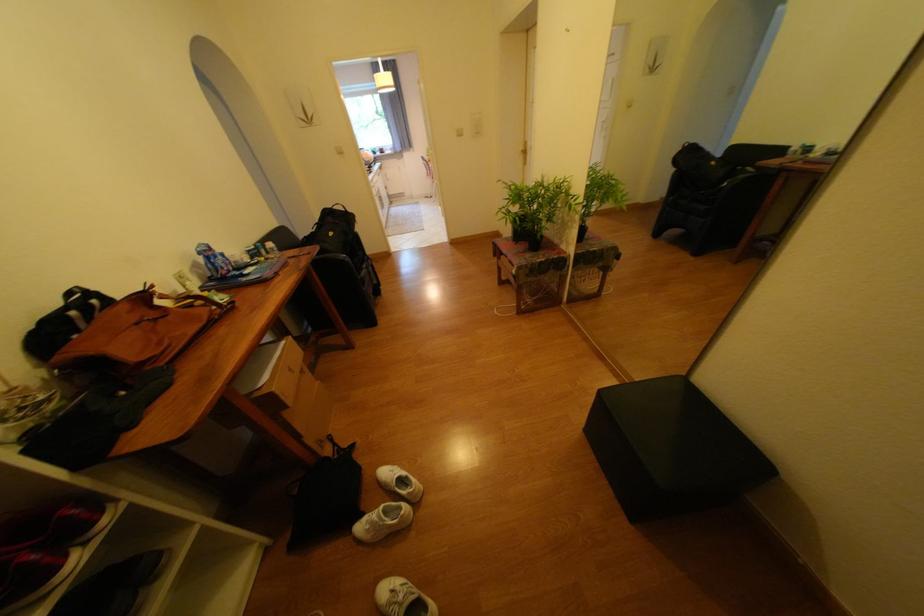
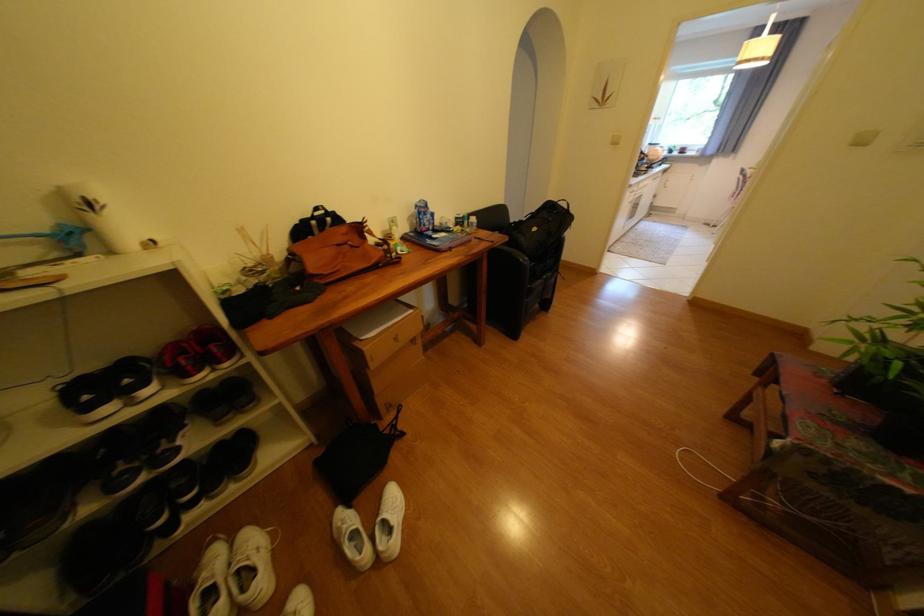
Locate, in the second image, the point that corresponds to the point at 469,134 in the first image.

(872, 142)